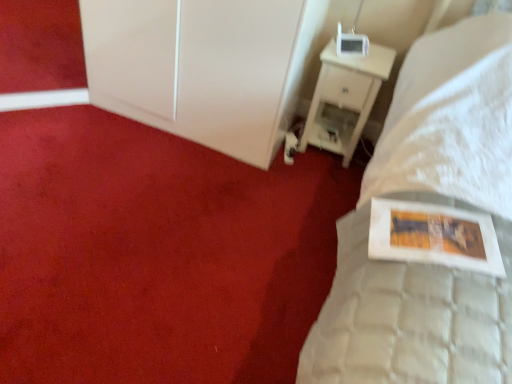
Question: Is point (335, 132) positioned closer to the camera than point (186, 117)?

Choices:
 (A) closer
 (B) farther

Answer: (B)

Question: Relative to white glossy cabinet at upper left, is white wood nightstand at upper right in front or behind?

Choices:
 (A) front
 (B) behind

Answer: (B)

Question: Considering the real-world distances, which object is farthest from the white wood nightstand at upper right?

Choices:
 (A) white glossy cabinet at upper left
 (B) white glossy picture frame at upper right

Answer: (B)

Question: Which object is the farthest from the white glossy picture frame at upper right?

Choices:
 (A) white wood nightstand at upper right
 (B) white glossy cabinet at upper left

Answer: (A)